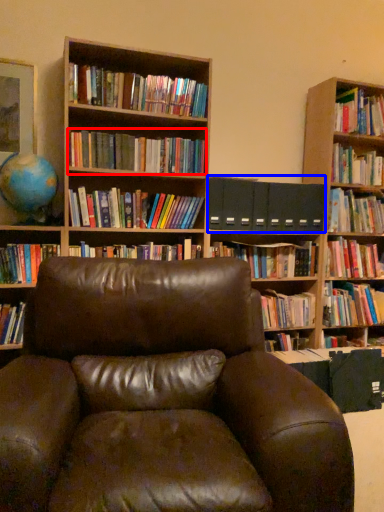
Question: Which object appears farthest to the camera in this image, book (highlighted by a red box) or paperback book (highlighted by a blue box)?

Choices:
 (A) book
 (B) paperback book

Answer: (B)